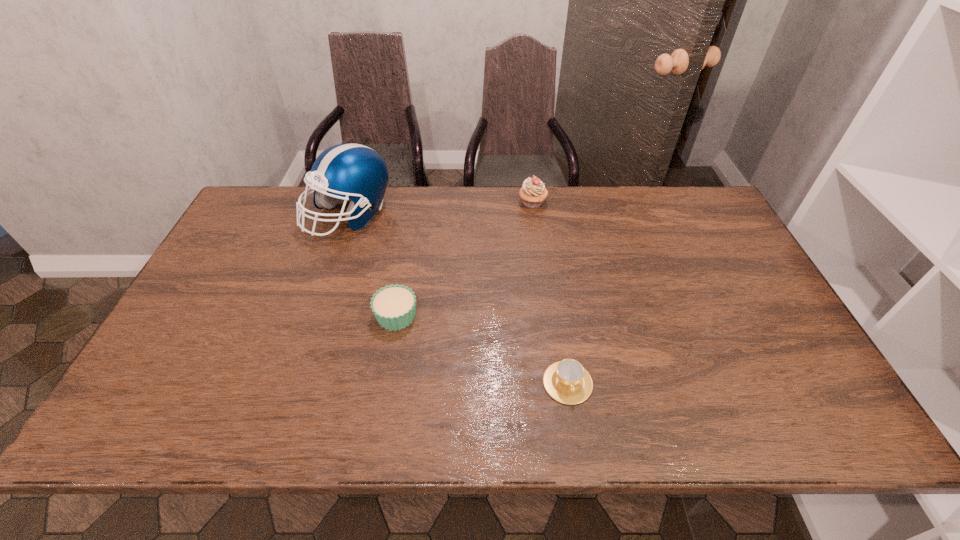
Find the location of a particular element. the tallest object is located at coordinates (345, 171).

Locate an element on the screen. This screenshot has height=540, width=960. football helmet is located at coordinates (345, 171).

Find the location of a particular element. The image size is (960, 540). the farther cupcake is located at coordinates (533, 192).

At what (x,y) coordinates should I click in order to perform the action: click on the taller cupcake. Please return your answer as a coordinate pair (x, y). Looking at the image, I should click on (533, 192).

This screenshot has width=960, height=540. Find the location of `the second shortest object`. the second shortest object is located at coordinates (394, 307).

This screenshot has width=960, height=540. I want to click on the shorter cupcake, so click(394, 307).

I want to click on the shortest object, so click(x=567, y=381).

Locate an element on the screen. This screenshot has height=540, width=960. the nearest object is located at coordinates (567, 381).

Locate an element on the screen. blank space located at the front of the tallest object with the faceguard is located at coordinates (316, 314).

Locate an element on the screen. free region located 0.090m on the right of the taller cupcake is located at coordinates (573, 203).